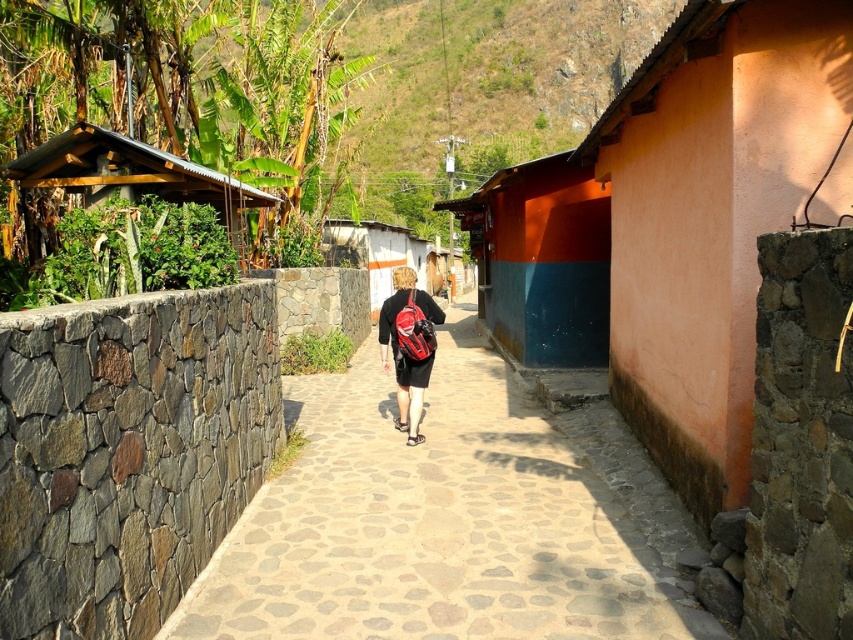
Which is below, orange smooth wall at right or matte red backpack at center?

matte red backpack at center is lower down.

Find the location of a particular element. orange smooth wall at right is located at coordinates (712, 216).

The width and height of the screenshot is (853, 640). I want to click on orange smooth wall at right, so click(712, 216).

Consider the image. Who is more distant from viewer, (363, 536) or (630, 125)?

Positioned behind is point (630, 125).

How far apart are stone paved path at center and orange smooth wall at right?

stone paved path at center and orange smooth wall at right are 3.49 meters apart.

Who is more forward, (614, 426) or (776, 227)?

Point (776, 227) is more forward.

This screenshot has width=853, height=640. In order to click on stone paved path at center in this screenshot , I will do `click(451, 518)`.

Is stone paved path at center positioned in front of wooden hut at left?

Yes, it is in front of wooden hut at left.

Does stone paved path at center come behind wooden hut at left?

That is False.

Measure the distance between point (560, 630) and camera.

Point (560, 630) and camera are 13.35 feet apart from each other.

Where is `stone paved path at center`? This screenshot has height=640, width=853. stone paved path at center is located at coordinates (451, 518).